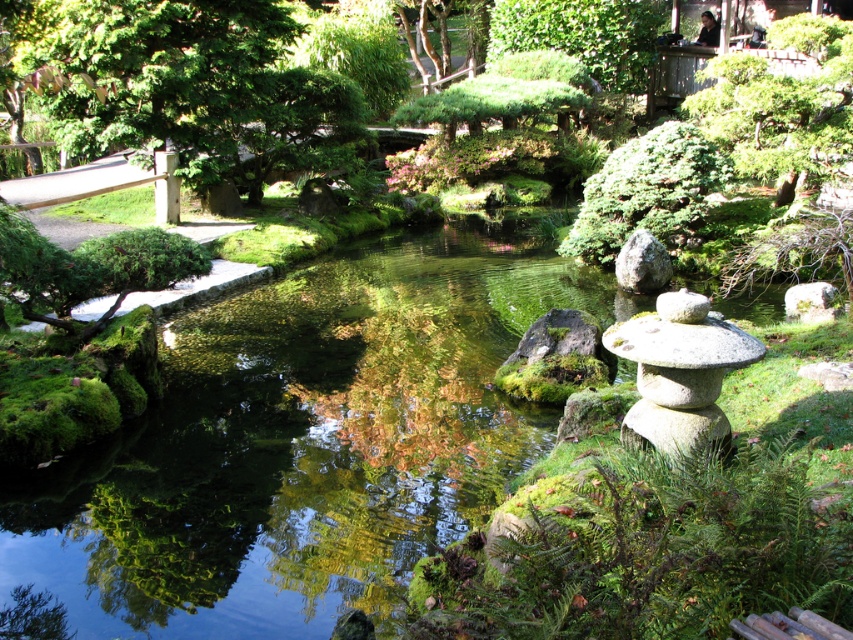
Question: Among these objects, which one is farthest from the camera?

Choices:
 (A) green textured tree at upper right
 (B) green leafy tree at upper left

Answer: (B)

Question: In this image, where is green textured tree at upper right located relative to gray rough rock at center?

Choices:
 (A) above
 (B) below

Answer: (A)

Question: Which point is closer to the camera?

Choices:
 (A) green textured tree at upper right
 (B) smooth gray stone at center-right
 (C) gray rough rock at center

Answer: (B)

Question: Is green textured tree at upper right bigger than gray rough rock at center?

Choices:
 (A) no
 (B) yes

Answer: (B)

Question: Does green leafy tree at upper left have a lesser width compared to green textured tree at upper right?

Choices:
 (A) yes
 (B) no

Answer: (B)

Question: Among these points, which one is nearest to the camera?

Choices:
 (A) (802, 32)
 (B) (653, 285)

Answer: (B)